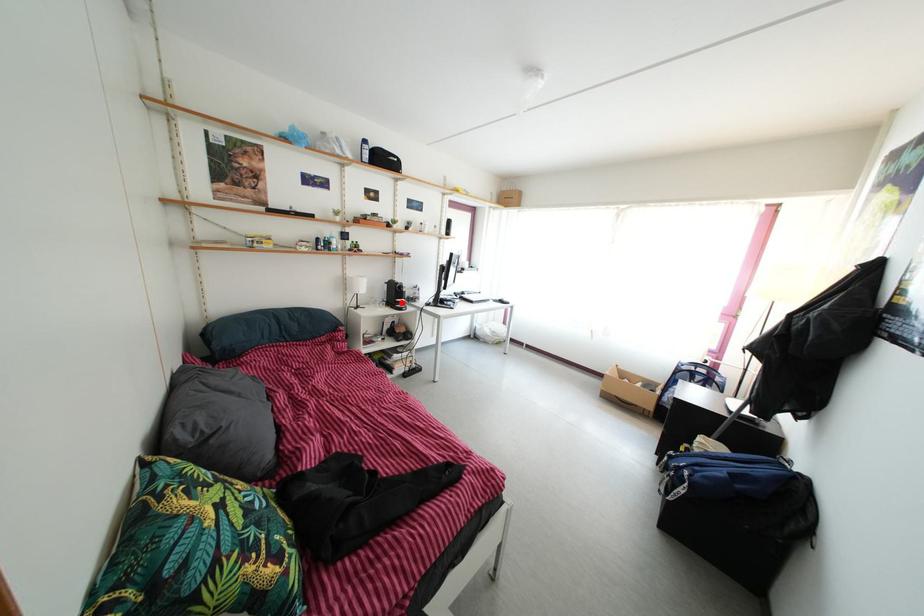
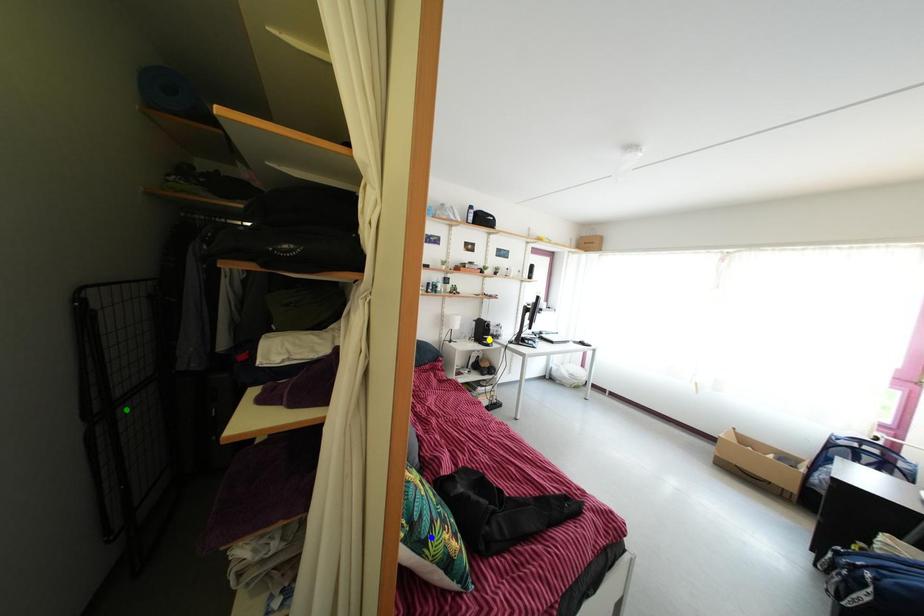
Question: I am providing you with two images of the same scene from different viewpoints. A red point is marked on the first image. You are given multiple points on the second image. Which point in image 2 is actually the same real-world point as the red point in image 1?

Choices:
 (A) yellow point
 (B) green point
 (C) blue point

Answer: (A)